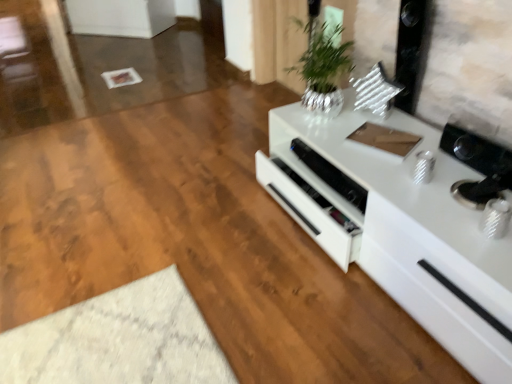
Question: Is white glossy speaker at center to the left or to the right of white glossy cabinet at right in the image?

Choices:
 (A) left
 (B) right

Answer: (A)

Question: Looking at their shapes, would you say white glossy speaker at center is wider or thinner than white glossy cabinet at right?

Choices:
 (A) thin
 (B) wide

Answer: (A)

Question: Which of these objects is positioned closest to the silver metallic vase at upper center?

Choices:
 (A) white glossy cabinet at right
 (B) white glossy speaker at center

Answer: (B)

Question: Considering the real-world distances, which object is farthest from the silver metallic vase at upper center?

Choices:
 (A) white glossy cabinet at right
 (B) white glossy speaker at center

Answer: (A)